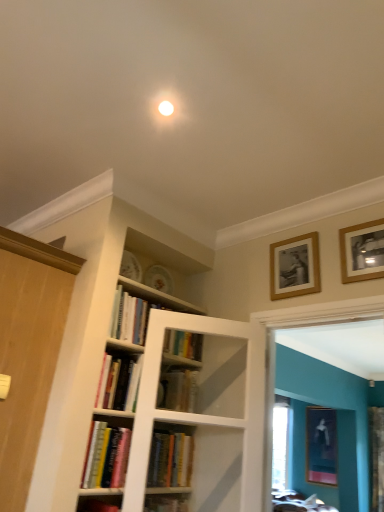
Question: In terms of height, does hardcover books at center, the first book viewed from the top, look taller or shorter compared to hardcover book at center, which appears as the third book when ordered from the bottom?

Choices:
 (A) short
 (B) tall

Answer: (B)

Question: Is hardcover books at center, the first book viewed from the top, to the left or to the right of hardcover book at center, arranged as the second book when viewed from the top, in the image?

Choices:
 (A) left
 (B) right

Answer: (B)

Question: Based on their relative distances, which object is nearer to the hardcover book at center, which appears as the second book when ordered from the bottom?

Choices:
 (A) wooden door at left
 (B) matte black picture frame at lower right, which is the third picture frame in front-to-back order
 (C) wooden picture frame at upper right, the 1th picture frame from the top
 (D) hardcover book at center, which appears as the third book when ordered from the bottom
 (E) hardcover books at center, positioned as the 4th book in bottom-to-top order

Answer: (E)

Question: Which object is the farthest from the wooden door at left?

Choices:
 (A) hardcover book at center, arranged as the second book when viewed from the top
 (B) hardcover book at center, marked as the third book in a top-to-bottom arrangement
 (C) matte black picture frame at lower right, positioned as the 1th picture frame in right-to-left order
 (D) hardcover books at lower left, the 1th book when ordered from bottom to top
 (E) wooden picture frame at upper right, the second picture frame from the top

Answer: (C)